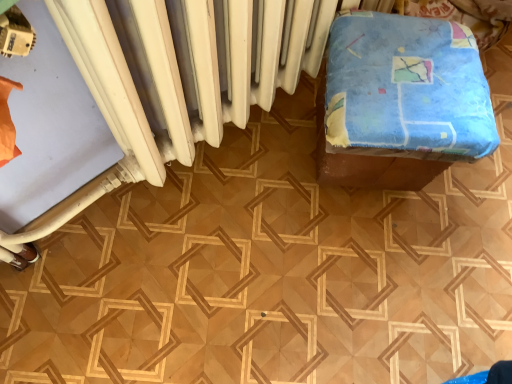
Describe the element at coordinates (187, 66) in the screenshot. I see `white matte radiator at upper center` at that location.

At what (x,y) coordinates should I click in order to perform the action: click on white matte radiator at upper center. Please return your answer as a coordinate pair (x, y). Looking at the image, I should click on (187, 66).

You are a GUI agent. You are given a task and a screenshot of the screen. Output one action in this format:
    pyautogui.click(x=<x>, y=<y>)
    Task: Click on the white matte radiator at upper center
    Image resolution: width=512 pixels, height=384 pixels.
    Given the screenshot: What is the action you would take?
    pyautogui.click(x=187, y=66)